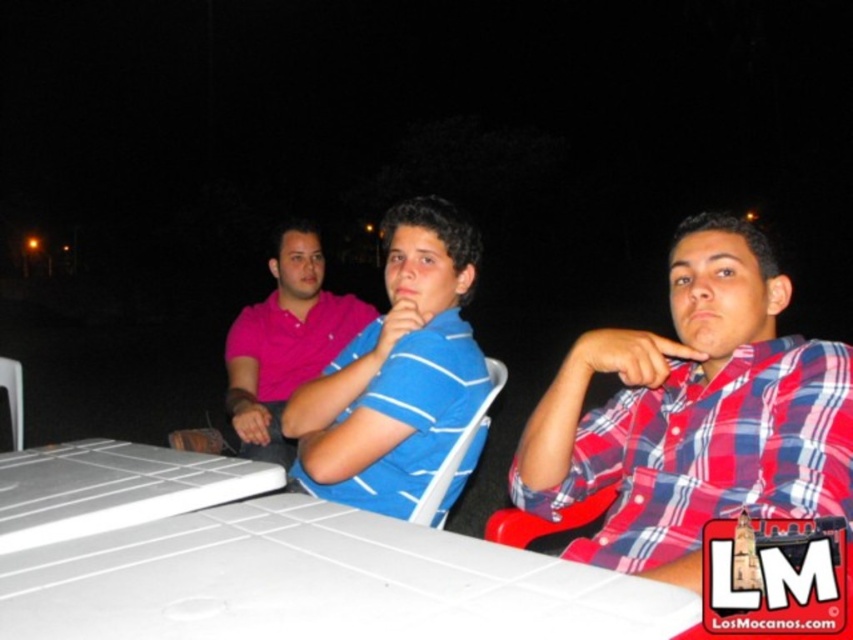
Is white plastic table at center further to camera compared to red plaid shirt at center?

That is False.

Can you confirm if white plastic table at center is positioned below red plaid shirt at center?

Yes.

The width and height of the screenshot is (853, 640). Describe the element at coordinates (317, 582) in the screenshot. I see `white plastic table at center` at that location.

Where is `white plastic table at center`? Image resolution: width=853 pixels, height=640 pixels. white plastic table at center is located at coordinates (317, 582).

Can you confirm if blue striped shirt at center is taller than white plastic laptop at lower left?

Yes.

Is point (447, 396) in front of point (218, 500)?

No, it is behind (218, 500).

Between point (451, 300) and point (173, 512), which one is positioned in front?

Positioned in front is point (173, 512).

Identify the location of blue striped shirt at center. (397, 372).

Is white plastic table at center bigger than white plastic laptop at lower left?

Yes, white plastic table at center is bigger than white plastic laptop at lower left.

Consider the image. Which is above, white plastic table at center or white plastic laptop at lower left?

white plastic laptop at lower left

Is point (325, 593) behind point (86, 504)?

No, it is in front of (86, 504).

Locate an element on the screen. white plastic table at center is located at coordinates (317, 582).